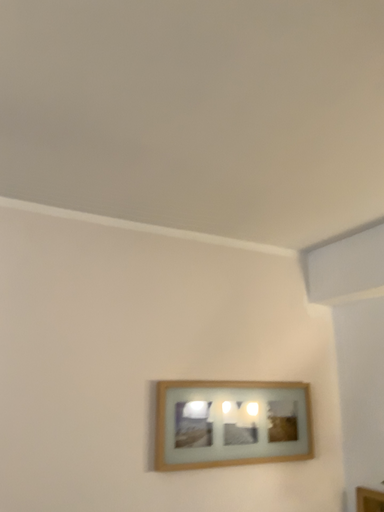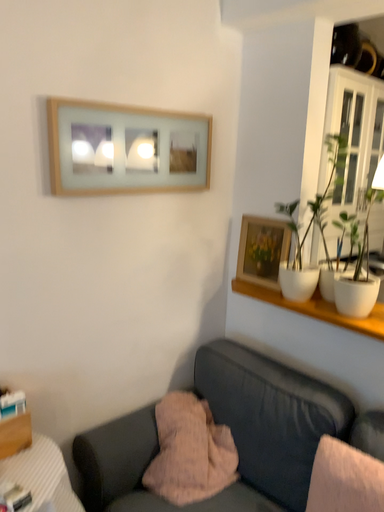
Question: How did the camera likely rotate when shooting the video?

Choices:
 (A) rotated left
 (B) rotated right

Answer: (B)